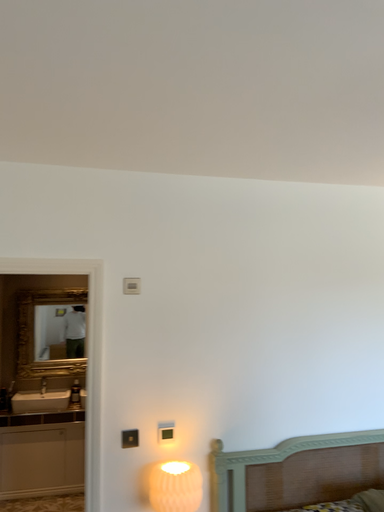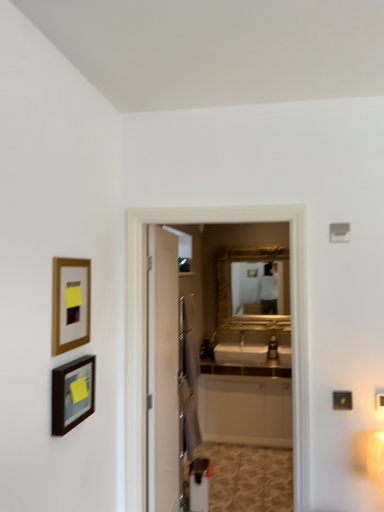
Question: How did the camera likely rotate when shooting the video?

Choices:
 (A) rotated left
 (B) rotated right

Answer: (A)